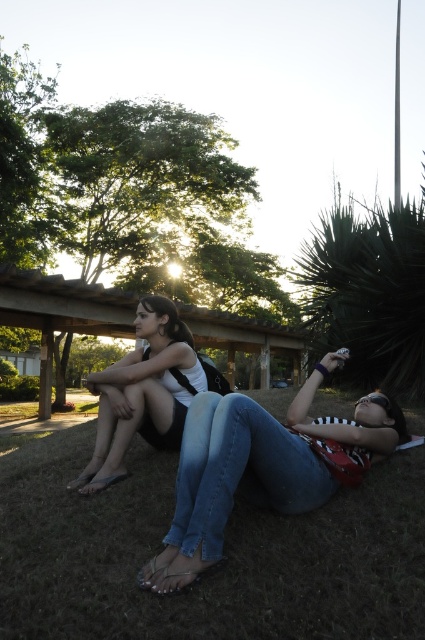
Based on the scene described, what is located at the coordinates point (223, 552)?

The coordinates point (223, 552) are occupied by green grass at lower center.